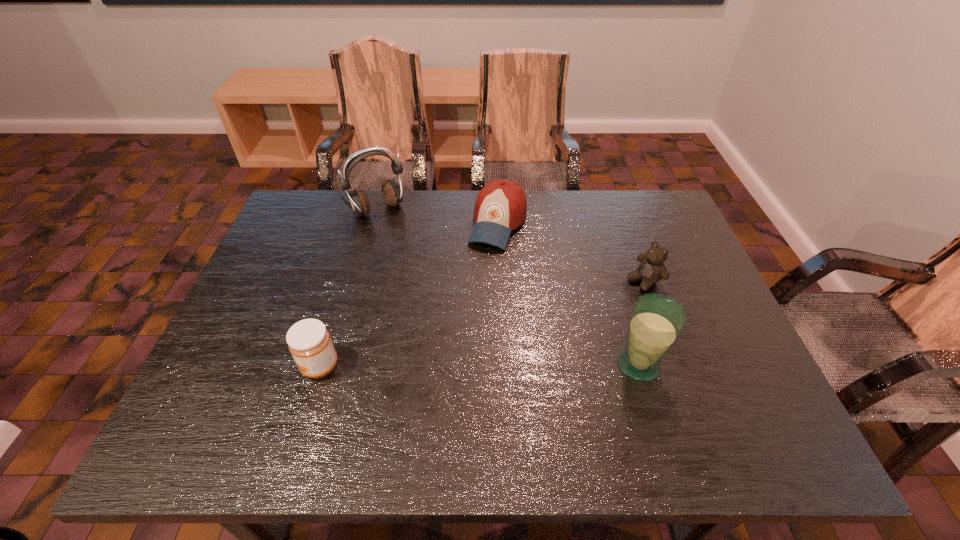
Where is `vacant point located 0.250m on the face of the teddy bear`? vacant point located 0.250m on the face of the teddy bear is located at coordinates (562, 330).

Where is `free location located on the face of the teddy bear`? The height and width of the screenshot is (540, 960). free location located on the face of the teddy bear is located at coordinates (532, 348).

You are a GUI agent. You are given a task and a screenshot of the screen. Output one action in this format:
    pyautogui.click(x=<x>, y=<y>)
    Task: Click on the vacant area situated 0.190m on the front-facing side of the third object from left to right
    Image resolution: width=960 pixels, height=540 pixels.
    Given the screenshot: What is the action you would take?
    pyautogui.click(x=469, y=298)

At what (x,y) coordinates should I click in order to perform the action: click on vacant space located on the front-facing side of the third object from left to right. Please return your answer as a coordinate pair (x, y). Image resolution: width=960 pixels, height=540 pixels. Looking at the image, I should click on (475, 285).

The height and width of the screenshot is (540, 960). In order to click on vacant region located on the front-facing side of the third object from left to right in this screenshot , I will do `click(454, 334)`.

Locate an element on the screen. This screenshot has height=540, width=960. vacant space situated on the ear pads of the tallest object is located at coordinates (451, 305).

You are a GUI agent. You are given a task and a screenshot of the screen. Output one action in this format:
    pyautogui.click(x=<x>, y=<y>)
    Task: Click on the vacant space located on the ear pads of the tallest object
    The width and height of the screenshot is (960, 540).
    Given the screenshot: What is the action you would take?
    pyautogui.click(x=414, y=255)

Find the location of a particular element. This screenshot has height=540, width=960. free region located on the ear pads of the tallest object is located at coordinates (396, 231).

You are a GUI agent. You are given a task and a screenshot of the screen. Output one action in this format:
    pyautogui.click(x=<x>, y=<y>)
    Task: Click on the baseball cap located in the far edge section of the desktop
    The width and height of the screenshot is (960, 540).
    Given the screenshot: What is the action you would take?
    pyautogui.click(x=501, y=206)

This screenshot has width=960, height=540. Find the location of `earphone that is at the far edge`. earphone that is at the far edge is located at coordinates (392, 193).